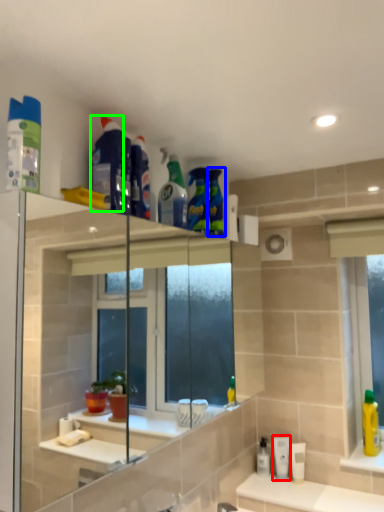
Question: Considering the real-world distances, which object is farthest from mouthwash (highlighted by a red box)? cleaning product (highlighted by a blue box) or cleaning product (highlighted by a green box)?

Choices:
 (A) cleaning product
 (B) cleaning product

Answer: (B)